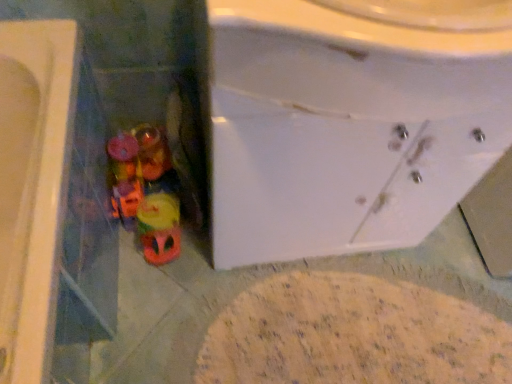
Question: Is white glossy sink at center taller or shorter than rubberized plastic toys at lower left?

Choices:
 (A) tall
 (B) short

Answer: (A)

Question: From a real-world perspective, is white glossy sink at center physically located above or below rubberized plastic toys at lower left?

Choices:
 (A) above
 (B) below

Answer: (A)

Question: From the image's perspective, relative to rubberized plastic toys at lower left, is white glossy sink at center above or below?

Choices:
 (A) above
 (B) below

Answer: (A)

Question: Is rubberized plastic toys at lower left taller or shorter than white glossy sink at center?

Choices:
 (A) short
 (B) tall

Answer: (A)

Question: Considering the positions of rubberized plastic toys at lower left and white glossy sink at center in the image, is rubberized plastic toys at lower left bigger or smaller than white glossy sink at center?

Choices:
 (A) big
 (B) small

Answer: (B)

Question: Is rubberized plastic toys at lower left in front of or behind white glossy sink at center in the image?

Choices:
 (A) behind
 (B) front

Answer: (A)

Question: From a real-world perspective, is rubberized plastic toys at lower left above or below white glossy sink at center?

Choices:
 (A) above
 (B) below

Answer: (B)